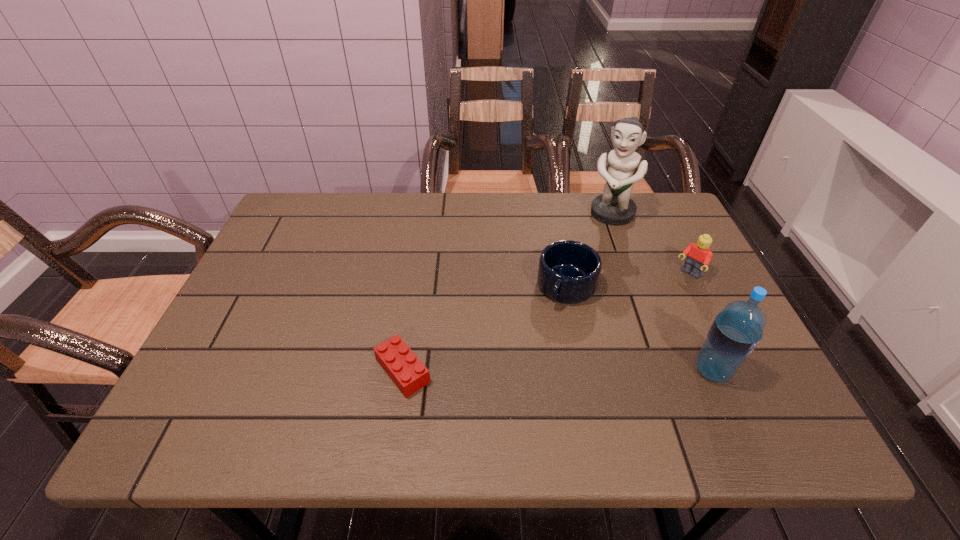
Find the location of a particular element. The image size is (960, 540). vacant spot on the desktop that is between the left Lego and the water bottle and is positioned with the handle on the side of the mug is located at coordinates (519, 370).

Where is `free space on the desktop that is between the leftmost object and the second tallest object and is positioned on the face of the farther Lego`? The width and height of the screenshot is (960, 540). free space on the desktop that is between the leftmost object and the second tallest object and is positioned on the face of the farther Lego is located at coordinates (582, 370).

Where is `vacant spot on the desktop that is between the leftmost object and the water bottle and is positioned on the front-facing side of the farthest object`? The image size is (960, 540). vacant spot on the desktop that is between the leftmost object and the water bottle and is positioned on the front-facing side of the farthest object is located at coordinates (516, 370).